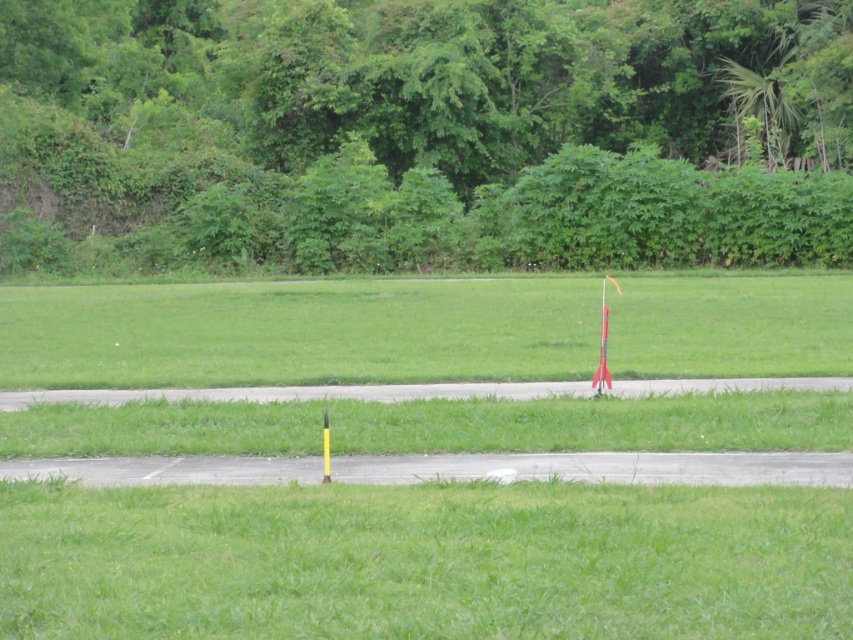
Is point (299, 237) positioned before point (345, 541)?

That is False.

What do you see at coordinates (422, 132) in the screenshot? This screenshot has width=853, height=640. I see `green leafy tree at upper center` at bounding box center [422, 132].

Identify the location of green leafy tree at upper center. (422, 132).

Is green grass at center positioned behind yellow matte rocket at center?

Yes, green grass at center is behind yellow matte rocket at center.

Can you confirm if green grass at center is thinner than yellow matte rocket at center?

Incorrect, green grass at center's width is not less than yellow matte rocket at center's.

This screenshot has height=640, width=853. What are the coordinates of `green grass at center` in the screenshot? It's located at (299, 332).

Is green grassy at lower center positioned before green grass at center?

Yes, it is.

Does green grassy at lower center have a lesser width compared to green grass at center?

Indeed, green grassy at lower center has a lesser width compared to green grass at center.

Who is more forward, [231,595] or [672,324]?

Point [231,595] is in front.

The height and width of the screenshot is (640, 853). What are the coordinates of `green grassy at lower center` in the screenshot? It's located at (424, 561).